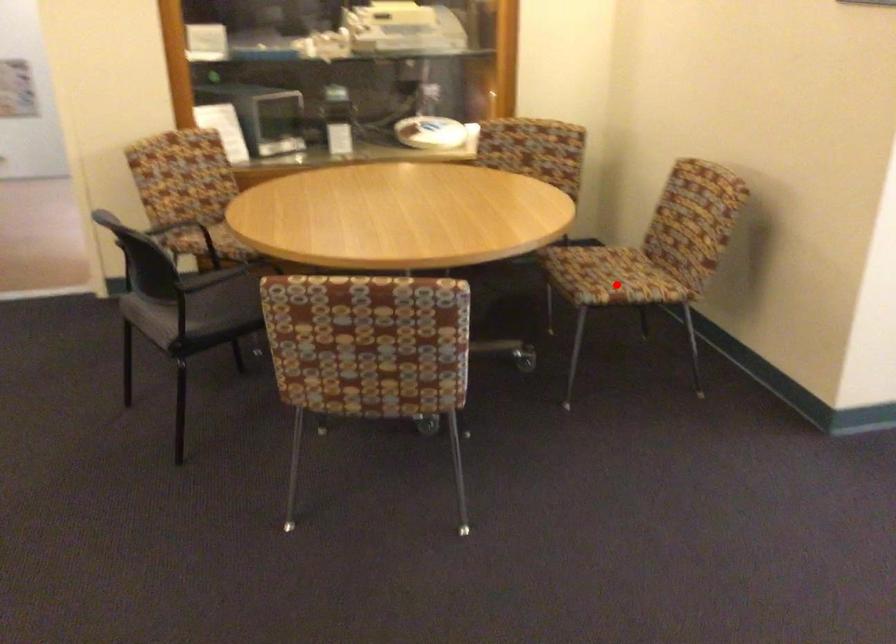
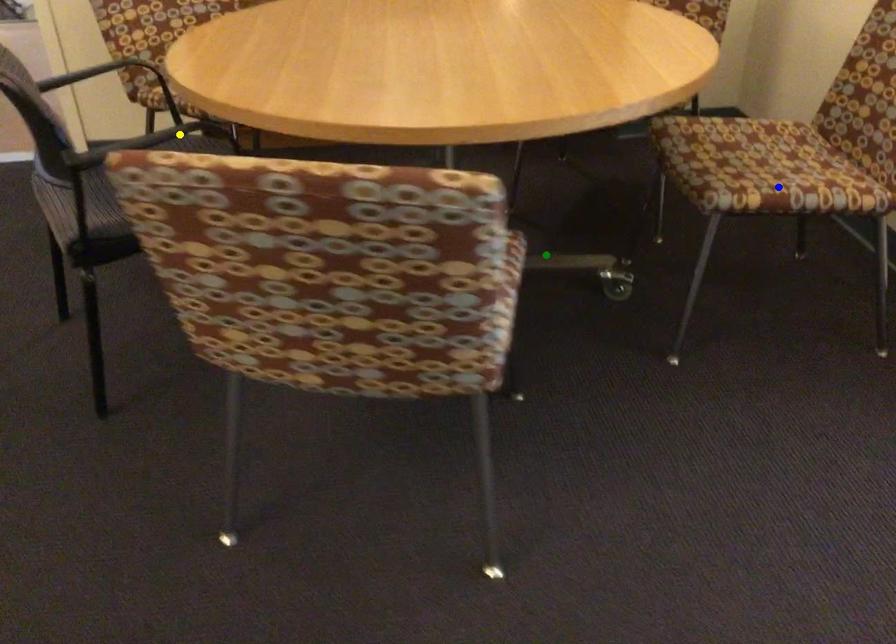
Question: I am providing you with two images of the same scene from different viewpoints. A red point is marked on the first image. You are given multiple points on the second image. Which point in image 2 is actually the same real-world point as the red point in image 1?

Choices:
 (A) yellow point
 (B) blue point
 (C) green point

Answer: (B)